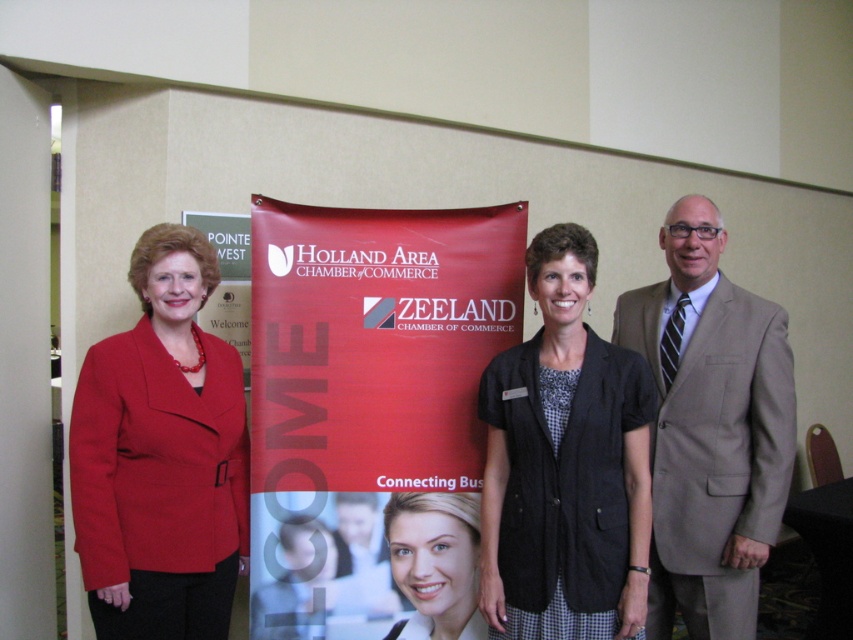
Between point (344, 291) and point (758, 388), which one is positioned behind?

Positioned behind is point (344, 291).

Between red matte banner at center and light brown suit at center, which one is positioned higher?

red matte banner at center is higher up.

You are a GUI agent. You are given a task and a screenshot of the screen. Output one action in this format:
    pyautogui.click(x=<x>, y=<y>)
    Task: Click on the red matte banner at center
    Image resolution: width=853 pixels, height=640 pixels.
    Given the screenshot: What is the action you would take?
    pyautogui.click(x=372, y=413)

The width and height of the screenshot is (853, 640). I want to click on red matte banner at center, so click(372, 413).

Does red matte banner at center appear on the right side of black textured vest at center?

Incorrect, red matte banner at center is not on the right side of black textured vest at center.

Consider the image. Is red matte banner at center to the left of black textured vest at center from the viewer's perspective?

Indeed, red matte banner at center is positioned on the left side of black textured vest at center.

This screenshot has width=853, height=640. What do you see at coordinates (372, 413) in the screenshot?
I see `red matte banner at center` at bounding box center [372, 413].

Image resolution: width=853 pixels, height=640 pixels. What are the coordinates of `red matte banner at center` in the screenshot? It's located at (372, 413).

Which is more to the left, matte red blazer at left or light brown suit at center?

matte red blazer at left

Is matte red blazer at left thinner than light brown suit at center?

Indeed, matte red blazer at left has a lesser width compared to light brown suit at center.

Identify the location of matte red blazer at left. This screenshot has width=853, height=640. (161, 456).